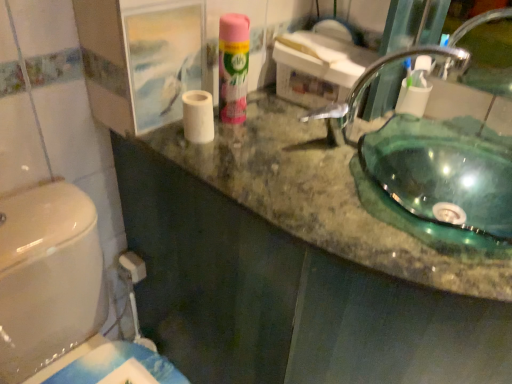
Describe the element at coordinates (233, 67) in the screenshot. I see `pink matte air freshener at upper center` at that location.

What is the approximate width of white matte toilet paper at center, marked as the second toilet paper in a back-to-front arrangement?

It is 2.87 inches.

In order to click on white matte toilet paper at upper right, positioned as the second toilet paper in left-to-right order in this screenshot , I will do `click(413, 96)`.

At what (x,y) coordinates should I click in order to perform the action: click on green marble counter top at center. Please return your answer as a coordinate pair (x, y). Image resolution: width=512 pixels, height=384 pixels. Looking at the image, I should click on (327, 198).

Identify the location of transparent glass sink at upper right. point(415,189).

Considering the sizes of objects white matte toilet paper at upper right, arranged as the 2th toilet paper when viewed from the front, and pink matte air freshener at upper center in the image provided, who is smaller, white matte toilet paper at upper right, arranged as the 2th toilet paper when viewed from the front, or pink matte air freshener at upper center?

white matte toilet paper at upper right, arranged as the 2th toilet paper when viewed from the front, is smaller.

Between point (414, 111) and point (222, 27), which one is positioned behind?

Positioned behind is point (414, 111).

Is white matte toilet paper at upper right, the first toilet paper when ordered from back to front, not within pink matte air freshener at upper center?

Yes, white matte toilet paper at upper right, the first toilet paper when ordered from back to front, is not within pink matte air freshener at upper center.

Is white matte toilet paper at upper right, positioned as the second toilet paper in left-to-right order, to the right of pink matte air freshener at upper center from the viewer's perspective?

Yes, white matte toilet paper at upper right, positioned as the second toilet paper in left-to-right order, is to the right of pink matte air freshener at upper center.

From the picture: Does white matte toilet paper at center, marked as the second toilet paper in a back-to-front arrangement, lie in front of green marble counter top at center?

No, it is behind green marble counter top at center.

Choose the correct answer: Is white matte toilet paper at center, the 1th toilet paper from the left, inside green marble counter top at center or outside it?

white matte toilet paper at center, the 1th toilet paper from the left, lies outside green marble counter top at center.

From a real-world perspective, who is located lower, white matte toilet paper at center, marked as the 1th toilet paper in a front-to-back arrangement, or green marble counter top at center?

green marble counter top at center, from a real-world perspective.

Considering the positions of point (201, 132) and point (428, 260), is point (201, 132) closer or farther from the camera than point (428, 260)?

Point (201, 132) appears to be farther away from the viewer than point (428, 260).

Is green marble counter top at center facing towards white matte toilet paper at upper right, the first toilet paper when ordered from back to front?

No.

In the scene shown: Is green marble counter top at center shorter than white matte toilet paper at upper right, which is the 1th toilet paper from right to left?

In fact, green marble counter top at center may be taller than white matte toilet paper at upper right, which is the 1th toilet paper from right to left.

From the image's perspective, is green marble counter top at center located above or below white matte toilet paper at upper right, which is the 1th toilet paper from right to left?

green marble counter top at center is situated lower than white matte toilet paper at upper right, which is the 1th toilet paper from right to left, in the image.

How different are the orientations of green marble counter top at center and white matte toilet paper at upper right, arranged as the 2th toilet paper when viewed from the front, in degrees?

They differ by 0.000958 degrees in their facing directions.

Is pink matte air freshener at upper center facing away from transparent glass sink at upper right?

pink matte air freshener at upper center does not have its back to transparent glass sink at upper right.

Where is `sink located on the right of pink matte air freshener at upper center`? The height and width of the screenshot is (384, 512). sink located on the right of pink matte air freshener at upper center is located at coordinates (415, 189).

Is pink matte air freshener at upper center next to transparent glass sink at upper right?

No, pink matte air freshener at upper center is not making contact with transparent glass sink at upper right.

Which is behind, point (247, 59) or point (417, 236)?

Point (247, 59)

Is white matte toilet paper at center, marked as the second toilet paper in a back-to-front arrangement, closer to the viewer compared to transparent glass sink at upper right?

That is False.

Looking at this image, is white matte toilet paper at center, which is the 2th toilet paper from right to left, to the left of transparent glass sink at upper right from the viewer's perspective?

Indeed, white matte toilet paper at center, which is the 2th toilet paper from right to left, is positioned on the left side of transparent glass sink at upper right.

Measure the distance from white matte toilet paper at center, marked as the second toilet paper in a back-to-front arrangement, to transparent glass sink at upper right.

white matte toilet paper at center, marked as the second toilet paper in a back-to-front arrangement, is 16.52 inches from transparent glass sink at upper right.

Is white matte toilet paper at center, which is the 2th toilet paper from right to left, touching transparent glass sink at upper right?

No, white matte toilet paper at center, which is the 2th toilet paper from right to left, is not next to transparent glass sink at upper right.

The image size is (512, 384). In order to click on the 2nd toilet paper positioned below the pink matte air freshener at upper center (from a real-world perspective) in this screenshot , I will do `click(413, 96)`.

From a real-world perspective, between pink matte air freshener at upper center and white matte toilet paper at upper right, which is the 1th toilet paper from right to left, who is vertically higher?

pink matte air freshener at upper center.

Does pink matte air freshener at upper center have a smaller size compared to white matte toilet paper at upper right, positioned as the second toilet paper in left-to-right order?

No, pink matte air freshener at upper center is not smaller than white matte toilet paper at upper right, positioned as the second toilet paper in left-to-right order.

Is pink matte air freshener at upper center in contact with white matte toilet paper at upper right, arranged as the 2th toilet paper when viewed from the front?

They are not placed beside each other.

Is transparent glass sink at upper right situated inside pink matte air freshener at upper center or outside?

transparent glass sink at upper right is located beyond the bounds of pink matte air freshener at upper center.

From the image's perspective, which object appears higher, transparent glass sink at upper right or pink matte air freshener at upper center?

pink matte air freshener at upper center is shown above in the image.

From a real-world perspective, is transparent glass sink at upper right over pink matte air freshener at upper center?

Correct, in the physical world, transparent glass sink at upper right is higher than pink matte air freshener at upper center.

Does transparent glass sink at upper right have a lesser width compared to pink matte air freshener at upper center?

No.

Where is `toilet paper lying on the right of pink matte air freshener at upper center`? toilet paper lying on the right of pink matte air freshener at upper center is located at coordinates (413, 96).

Find the location of a particular element. counter top that is in front of the white matte toilet paper at center, marked as the 1th toilet paper in a front-to-back arrangement is located at coordinates (327, 198).

Which object lies further to the anchor point transparent glass sink at upper right, white matte toilet paper at center, marked as the 1th toilet paper in a front-to-back arrangement, or green marble counter top at center?

white matte toilet paper at center, marked as the 1th toilet paper in a front-to-back arrangement, is positioned further to the anchor transparent glass sink at upper right.

Estimate the real-world distances between objects in this image. Which object is further from green marble counter top at center, white matte toilet paper at center, marked as the 1th toilet paper in a front-to-back arrangement, or pink matte air freshener at upper center?

Among the two, pink matte air freshener at upper center is located further to green marble counter top at center.

Considering their positions, is white matte toilet paper at center, marked as the 1th toilet paper in a front-to-back arrangement, positioned further to green marble counter top at center than transparent glass sink at upper right?

white matte toilet paper at center, marked as the 1th toilet paper in a front-to-back arrangement, is further to green marble counter top at center.

Which object lies nearer to the anchor point green marble counter top at center, pink matte air freshener at upper center or transparent glass sink at upper right?

Based on the image, transparent glass sink at upper right appears to be nearer to green marble counter top at center.

From the image, which object appears to be nearer to white matte toilet paper at upper right, the first toilet paper when ordered from back to front, white matte toilet paper at center, the 1th toilet paper from the left, or transparent glass sink at upper right?

Among the two, transparent glass sink at upper right is located nearer to white matte toilet paper at upper right, the first toilet paper when ordered from back to front.

Based on their spatial positions, is white matte toilet paper at center, marked as the second toilet paper in a back-to-front arrangement, or green marble counter top at center further from white matte toilet paper at upper right, arranged as the 2th toilet paper when viewed from the front?

white matte toilet paper at center, marked as the second toilet paper in a back-to-front arrangement, is positioned further to the anchor white matte toilet paper at upper right, arranged as the 2th toilet paper when viewed from the front.

Based on their spatial positions, is transparent glass sink at upper right or pink matte air freshener at upper center further from white matte toilet paper at center, marked as the second toilet paper in a back-to-front arrangement?

Among the two, transparent glass sink at upper right is located further to white matte toilet paper at center, marked as the second toilet paper in a back-to-front arrangement.

Which object lies further to the anchor point pink matte air freshener at upper center, transparent glass sink at upper right or white matte toilet paper at center, marked as the 1th toilet paper in a front-to-back arrangement?

Based on the image, transparent glass sink at upper right appears to be further to pink matte air freshener at upper center.

Where is `sink between pink matte air freshener at upper center and green marble counter top at center in the vertical direction`? The image size is (512, 384). sink between pink matte air freshener at upper center and green marble counter top at center in the vertical direction is located at coordinates (415, 189).

Locate an element on the screen. This screenshot has height=384, width=512. sink between green marble counter top at center and white matte toilet paper at upper right, positioned as the second toilet paper in left-to-right order, from front to back is located at coordinates (415, 189).

Find the location of `cleaning product located between white matte toilet paper at center, marked as the second toilet paper in a back-to-front arrangement, and white matte toilet paper at upper right, which is the 1th toilet paper from right to left, in the left-right direction`. cleaning product located between white matte toilet paper at center, marked as the second toilet paper in a back-to-front arrangement, and white matte toilet paper at upper right, which is the 1th toilet paper from right to left, in the left-right direction is located at coordinates (233, 67).

Locate an element on the screen. This screenshot has height=384, width=512. cleaning product between white matte toilet paper at center, marked as the 1th toilet paper in a front-to-back arrangement, and transparent glass sink at upper right is located at coordinates click(x=233, y=67).